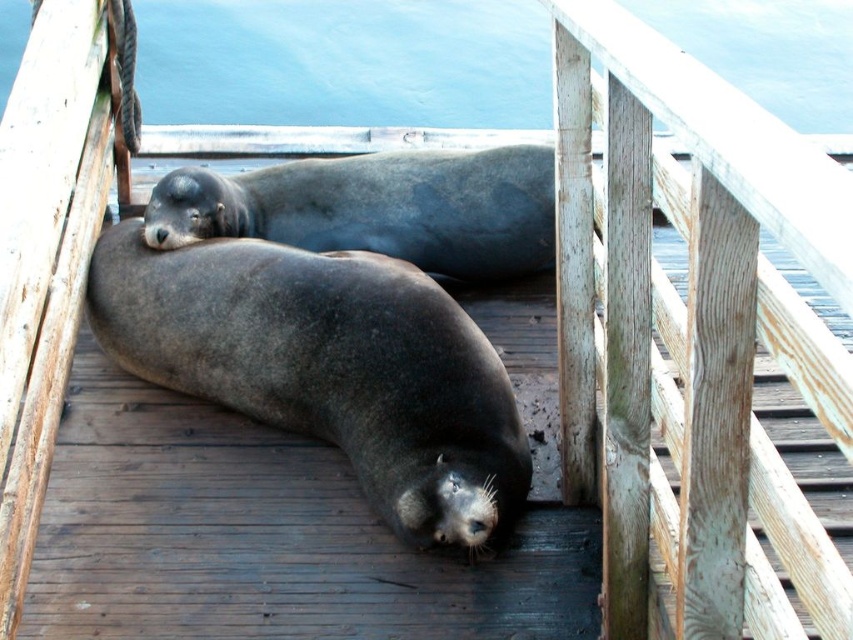
Question: In this image, where is weathered wood rail at upper center located relative to blue water at upper center?

Choices:
 (A) left
 (B) right

Answer: (B)

Question: Which of the following is the closest to the observer?

Choices:
 (A) blue water at upper center
 (B) weathered wood rail at upper center

Answer: (B)

Question: Can you confirm if weathered wood rail at upper center is positioned to the left of blue water at upper center?

Choices:
 (A) yes
 (B) no

Answer: (B)

Question: Can you confirm if weathered wood rail at upper center is positioned to the right of blue water at upper center?

Choices:
 (A) yes
 (B) no

Answer: (A)